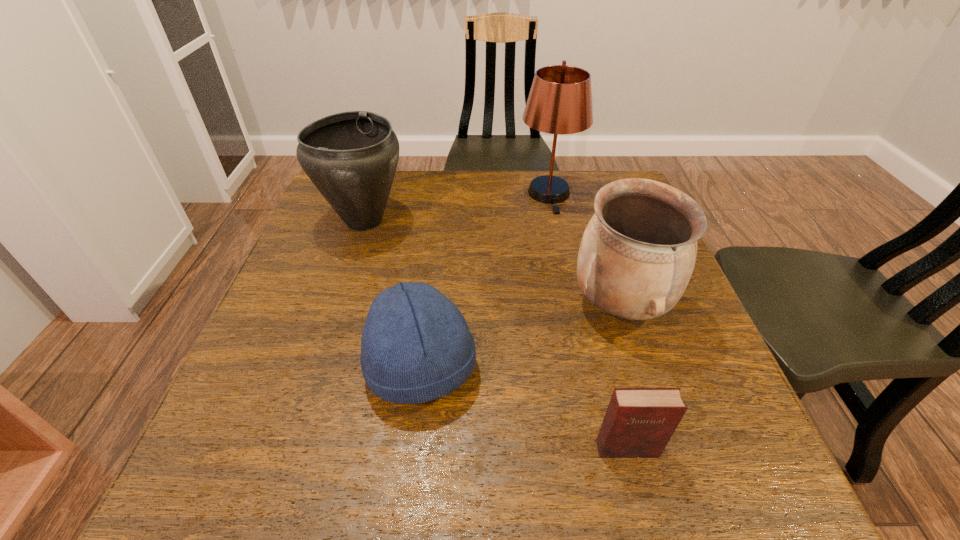
Image resolution: width=960 pixels, height=540 pixels. In the image, there is a desktop. What are the coordinates of `vacant space at the far left corner` in the screenshot? It's located at (314, 212).

In the image, there is a desktop. Where is `vacant space at the far right corner`? vacant space at the far right corner is located at coordinates (601, 173).

Where is `empty location between the right urn and the farther urn`? This screenshot has width=960, height=540. empty location between the right urn and the farther urn is located at coordinates (492, 262).

Find the location of a particular element. unoccupied area between the left urn and the nearest object is located at coordinates (495, 334).

Where is `vacant point located between the skullcap and the diary`? The height and width of the screenshot is (540, 960). vacant point located between the skullcap and the diary is located at coordinates (524, 408).

Locate an element on the screen. Image resolution: width=960 pixels, height=540 pixels. unoccupied position between the farther urn and the diary is located at coordinates (495, 334).

The height and width of the screenshot is (540, 960). I want to click on vacant area between the nearer urn and the skullcap, so click(x=520, y=336).

Image resolution: width=960 pixels, height=540 pixels. Identify the location of vacant region between the skullcap and the nearest object. (524, 408).

Locate an element on the screen. The width and height of the screenshot is (960, 540). free space that is in between the skullcap and the nearer urn is located at coordinates (520, 336).

This screenshot has height=540, width=960. In order to click on object that ranks as the third closest to the skullcap in this screenshot , I will do `click(351, 157)`.